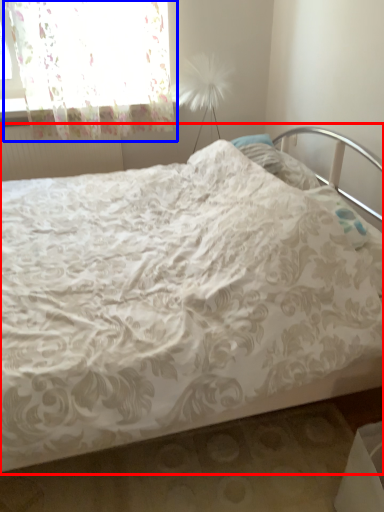
Question: Which point is closer to the camera, bed (highlighted by a red box) or curtain (highlighted by a blue box)?

Choices:
 (A) bed
 (B) curtain

Answer: (A)